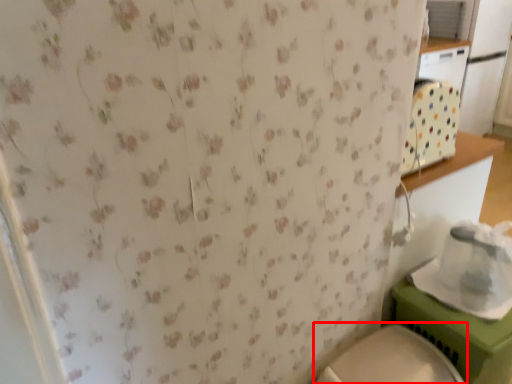
Question: From the image, what is the correct spatial relationship of toilet (annotated by the red box) in relation to appliance?

Choices:
 (A) left
 (B) right

Answer: (A)